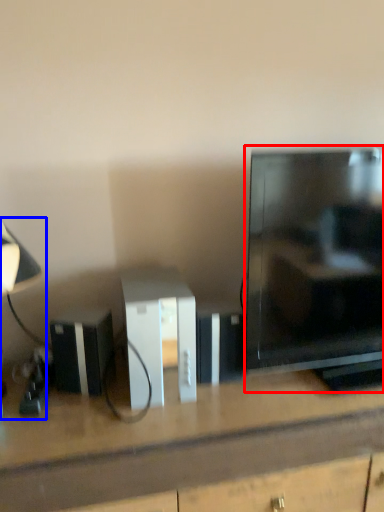
Question: Which point is further to the camera, television (highlighted by a red box) or table lamp (highlighted by a blue box)?

Choices:
 (A) television
 (B) table lamp

Answer: (A)